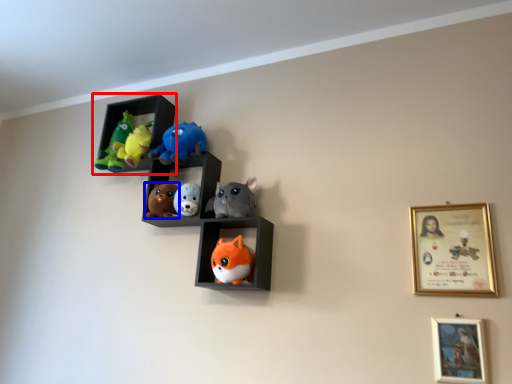
Question: Among these objects, which one is farthest to the camera, shelf (highlighted by a red box) or toy (highlighted by a blue box)?

Choices:
 (A) shelf
 (B) toy

Answer: (A)